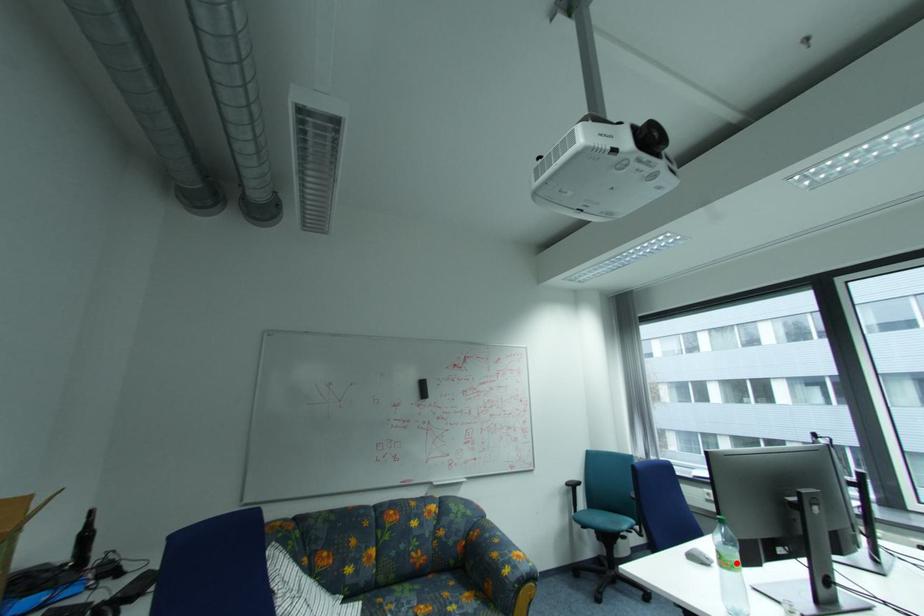
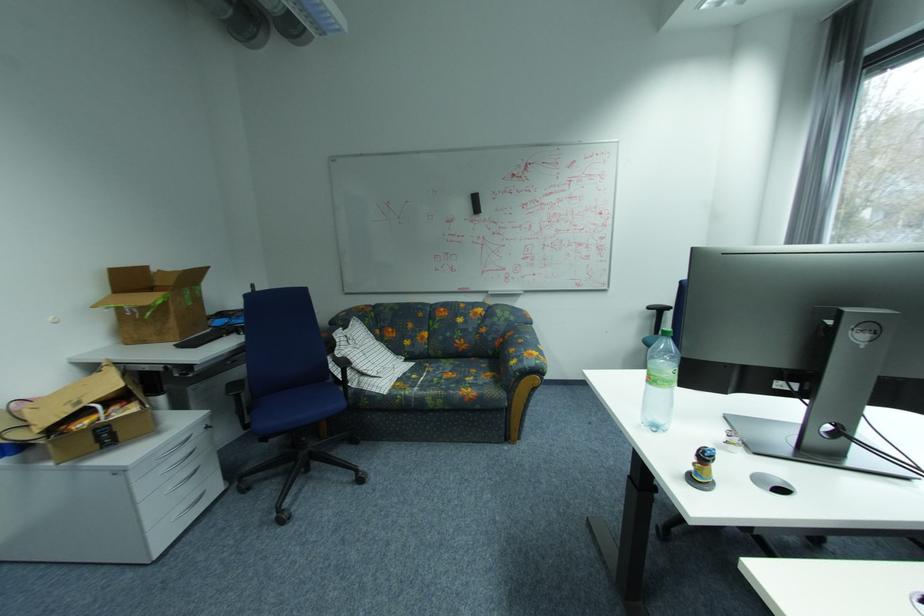
Find the pixel in the second image that matches the highlighted location in the first image.

(661, 379)